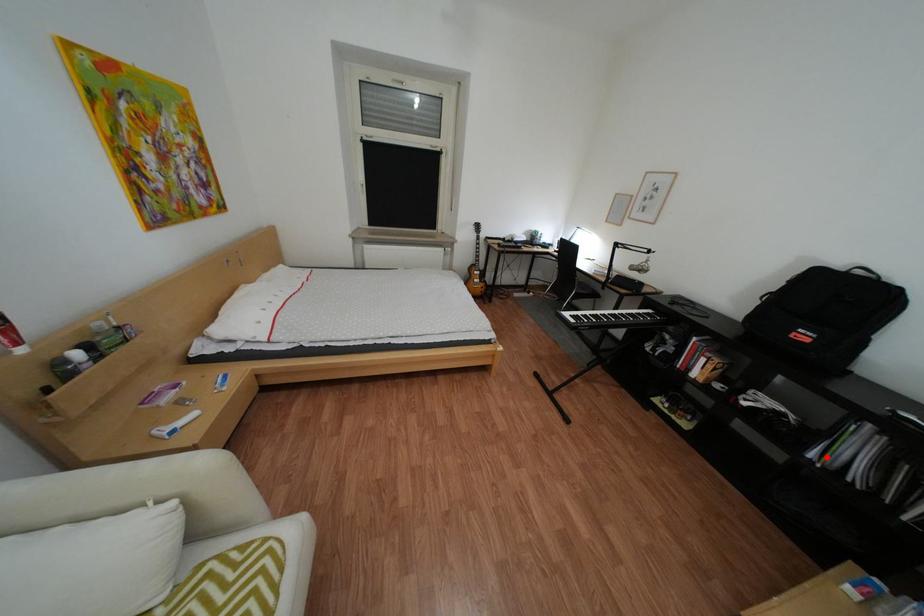
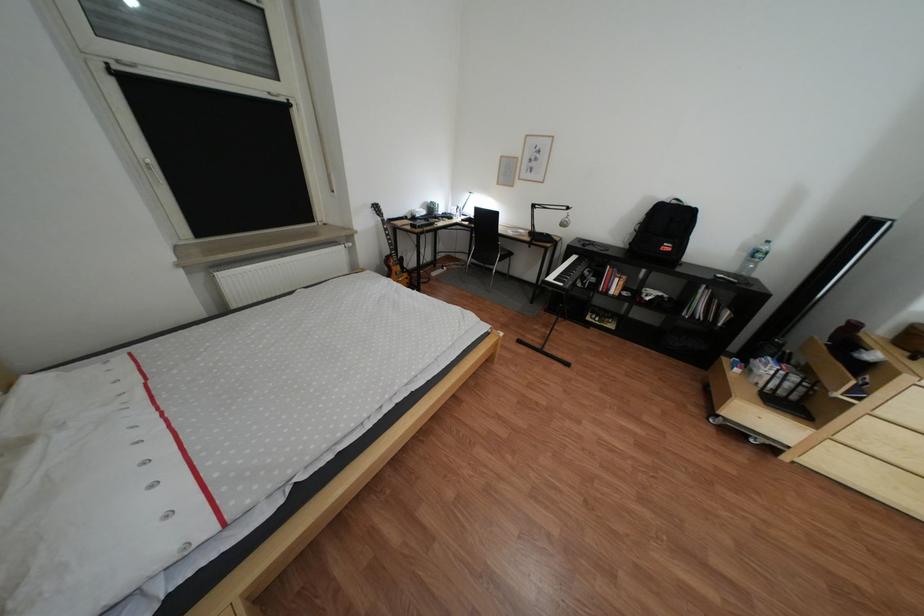
Question: A red point is marked in image1. In image2, is the corresponding 3D point closer to the camera or farther? Reply with the corresponding letter.

Choices:
 (A) The corresponding 3D point is closer.
 (B) The corresponding 3D point is farther.

Answer: (A)